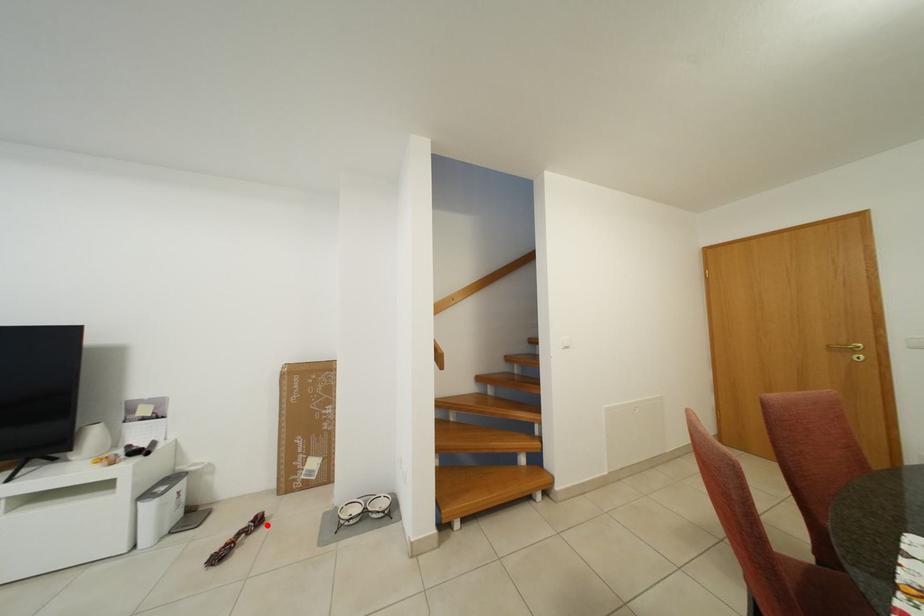
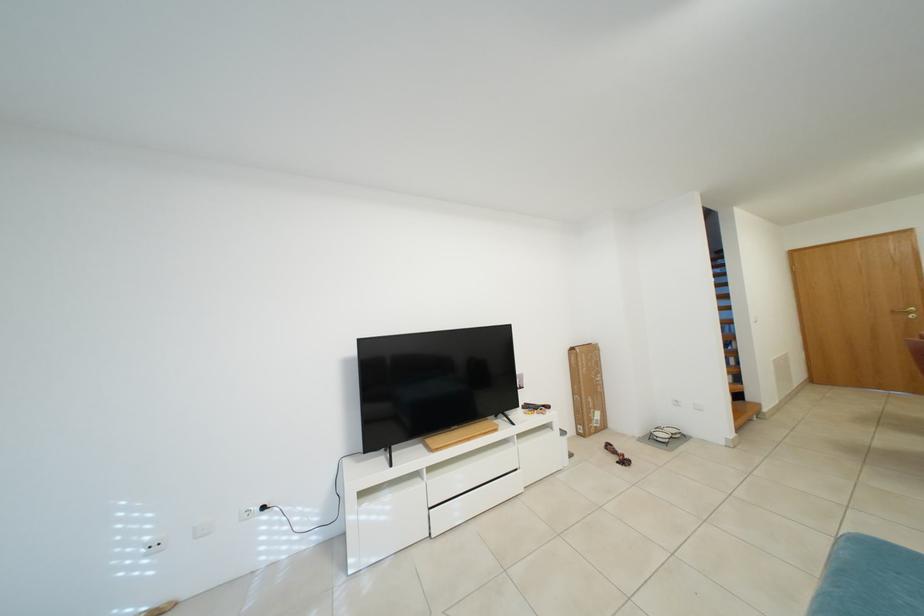
Question: I am providing you with two images of the same scene from different viewpoints. Image1 has a red point marked. In image2, the corresponding 3D location appears at what relative position? Reply with the corresponding letter.

Choices:
 (A) Closer
 (B) Farther

Answer: (B)